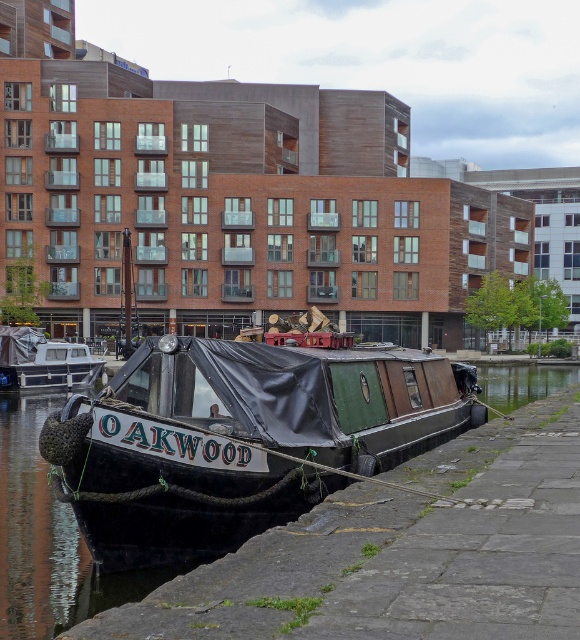
Question: Where is black polished wood boat at center located in relation to matte black boat at left in the image?

Choices:
 (A) left
 (B) right

Answer: (B)

Question: Which of the following is the closest to the observer?

Choices:
 (A) (201, 428)
 (B) (24, 378)

Answer: (A)

Question: Is the position of black polished wood boat at center less distant than that of matte black boat at left?

Choices:
 (A) yes
 (B) no

Answer: (A)

Question: Where is black polished wood boat at center located in relation to matte black boat at left in the image?

Choices:
 (A) right
 (B) left

Answer: (A)

Question: Which point appears closest to the camera in this image?

Choices:
 (A) (277, 404)
 (B) (99, 371)

Answer: (A)

Question: Which point is closer to the camera?

Choices:
 (A) (12, 364)
 (B) (322, 433)

Answer: (B)